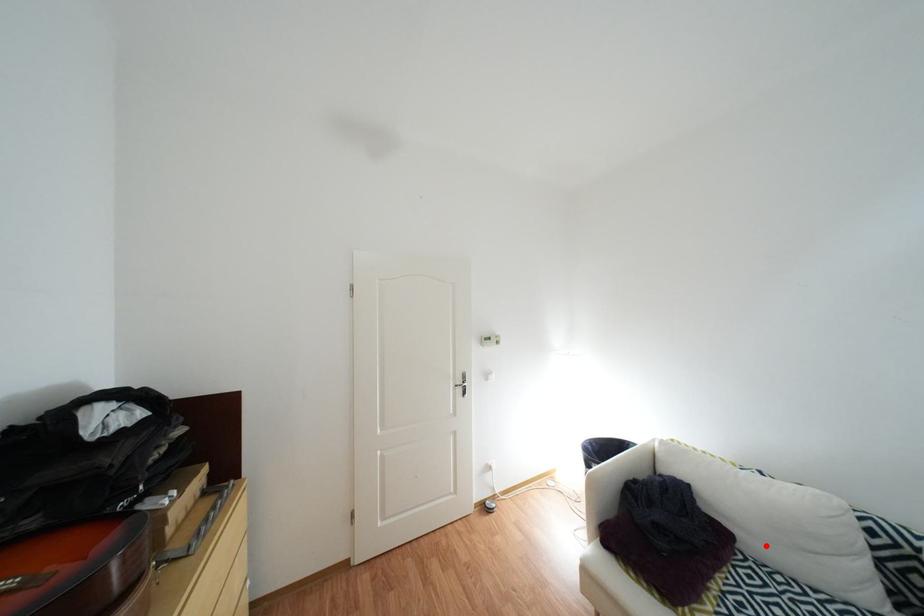
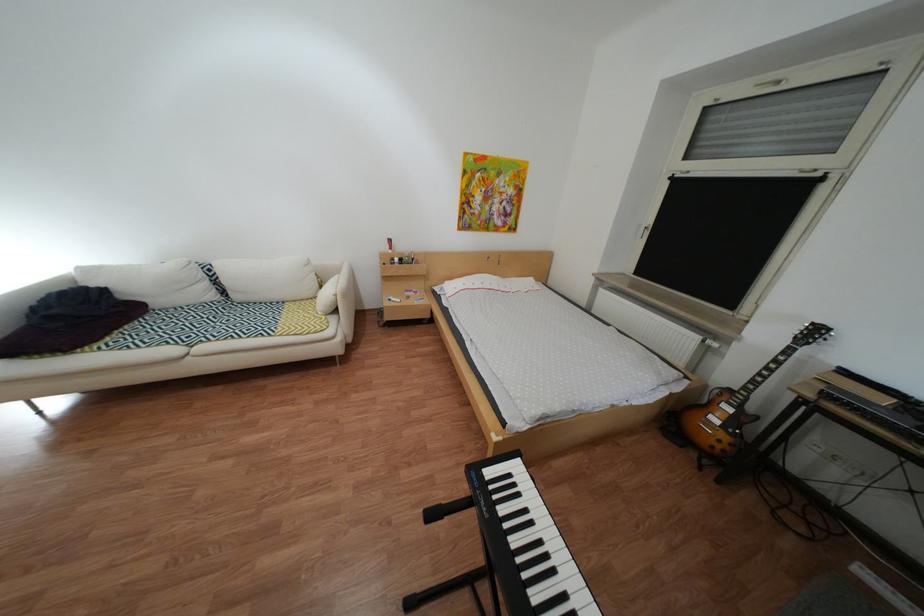
Locate, in the second image, the point that corresponds to the highlighted location in the first image.

(172, 304)